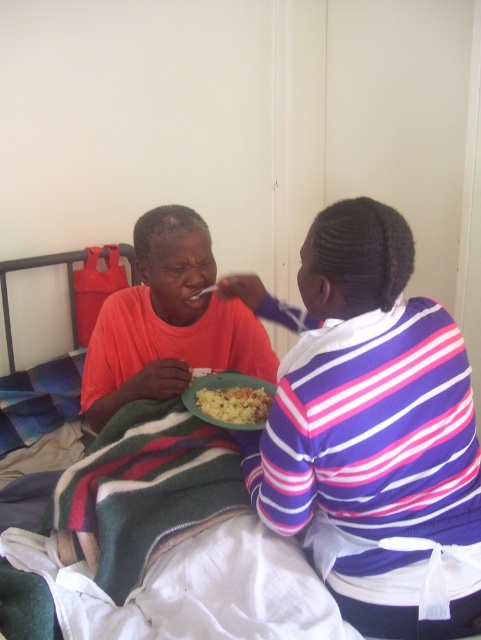
Question: In this image, where is purple striped shirt at upper right located relative to yellowish matte food at center?

Choices:
 (A) left
 (B) right

Answer: (B)

Question: Does purple striped shirt at upper right appear on the left side of yellowish matte food at center?

Choices:
 (A) yes
 (B) no

Answer: (B)

Question: Which of the following is the closest to the observer?

Choices:
 (A) (113, 433)
 (B) (153, 282)
 (C) (240, 400)

Answer: (A)

Question: Which point appears farthest from the camera in this image?

Choices:
 (A) (238, 404)
 (B) (378, 342)
 (C) (61, 536)

Answer: (A)

Question: Which object is closer to the camera taking this photo?

Choices:
 (A) matte orange shirt at left
 (B) striped wool blanket at lower left
 (C) yellowish matte food at center
 (D) purple striped shirt at upper right

Answer: (D)

Question: From the image, what is the correct spatial relationship of striped wool blanket at lower left in relation to matte orange shirt at left?

Choices:
 (A) left
 (B) right

Answer: (A)